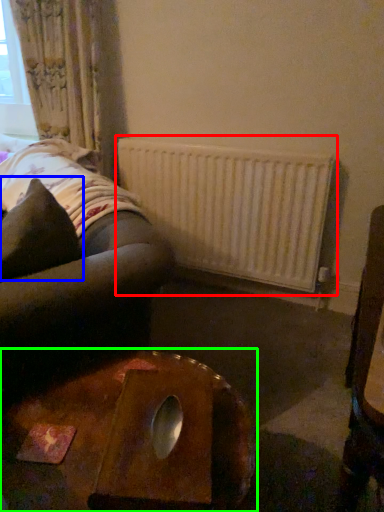
Question: Which object is positioned closest to radiator (highlighted by a red box)? Select from throw pillow (highlighted by a blue box) and table (highlighted by a green box).

Choices:
 (A) throw pillow
 (B) table

Answer: (A)